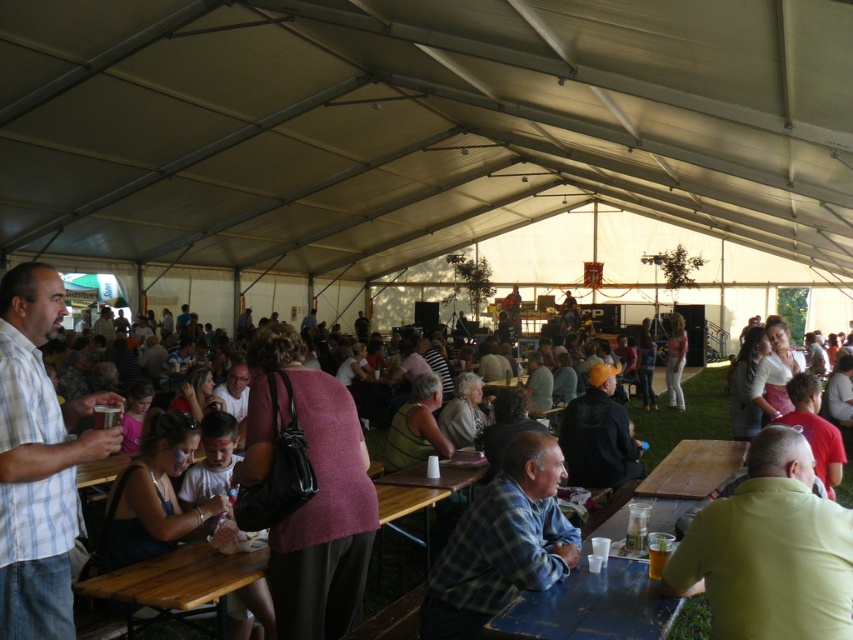
Is point (47, 312) positioned before point (480, 541)?

Yes, it is in front of point (480, 541).

Which of these two, light blue plaid shirt at left or plaid fabric shirt at lower center, stands taller?

light blue plaid shirt at left

Who is more distant from viewer, (65, 410) or (480, 518)?

The point (65, 410) is behind.

Find the location of a particular element. The height and width of the screenshot is (640, 853). light blue plaid shirt at left is located at coordinates (38, 460).

Can you confirm if yellow matte shirt at lower right is thinner than light blue plaid shirt at left?

No.

Between point (811, 552) and point (4, 600), which one is positioned in front?

Positioned in front is point (811, 552).

What are the coordinates of `yellow matte shirt at lower right` in the screenshot? It's located at [x=770, y=550].

Which is below, pink sweater at center or blue wooden table at lower center?

blue wooden table at lower center

Describe the element at coordinates (314, 493) in the screenshot. This screenshot has width=853, height=640. I see `pink sweater at center` at that location.

Image resolution: width=853 pixels, height=640 pixels. What are the coordinates of `pink sweater at center` in the screenshot? It's located at (314, 493).